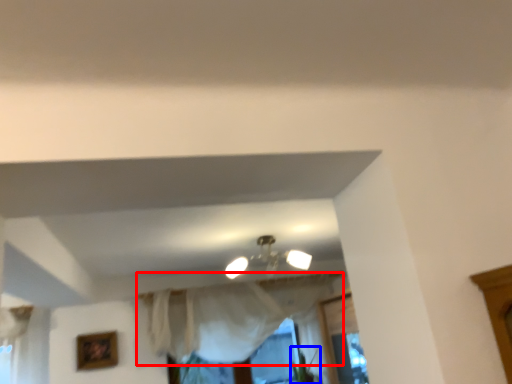
Question: Which object appears closest to the camera in this image, curtain (highlighted by a red box) or plant (highlighted by a blue box)?

Choices:
 (A) curtain
 (B) plant

Answer: (A)